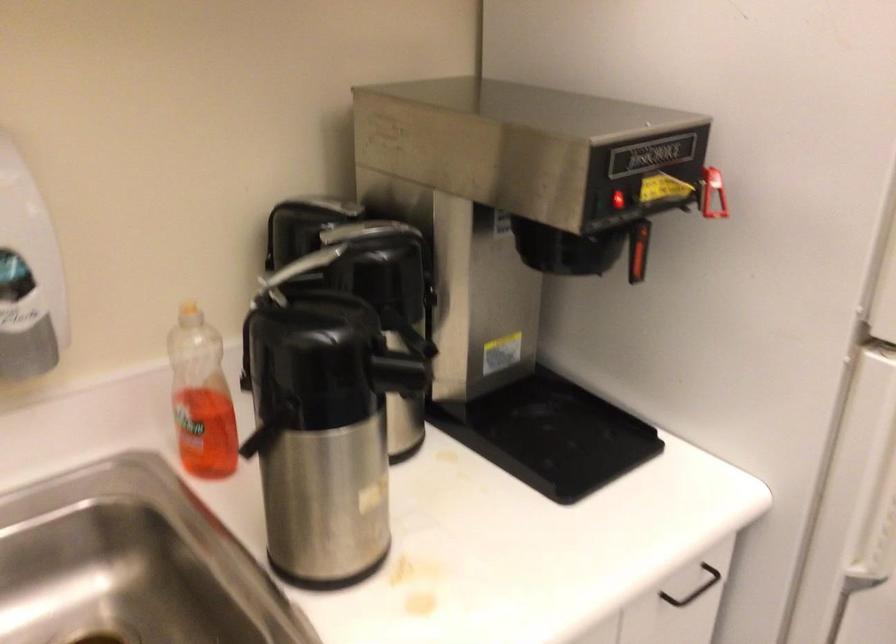
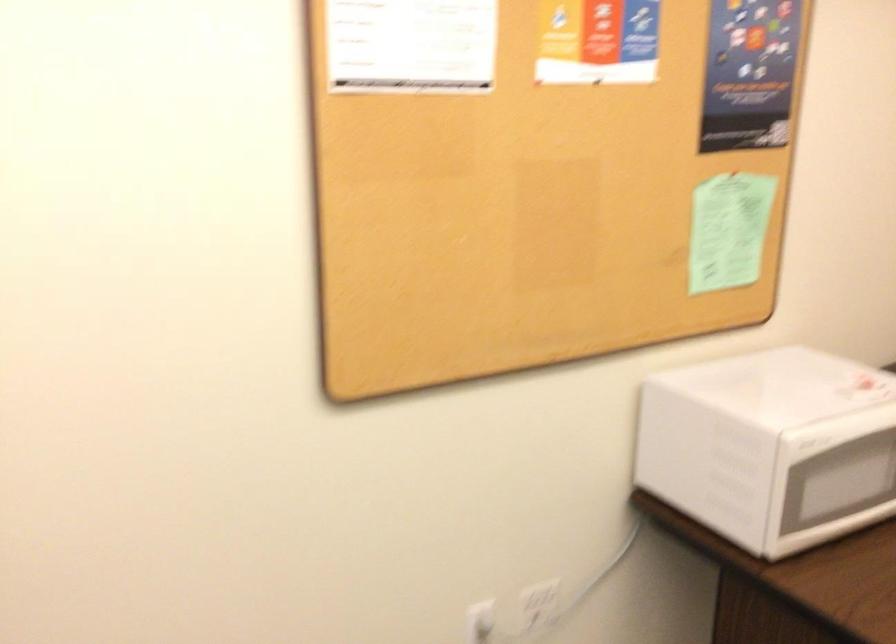
Question: The camera is either moving clockwise (left) or counter-clockwise (right) around the object. The first image is from the beginning of the video and the second image is from the end. Is the camera moving left or right when shooting the video?

Choices:
 (A) Left
 (B) Right

Answer: (A)